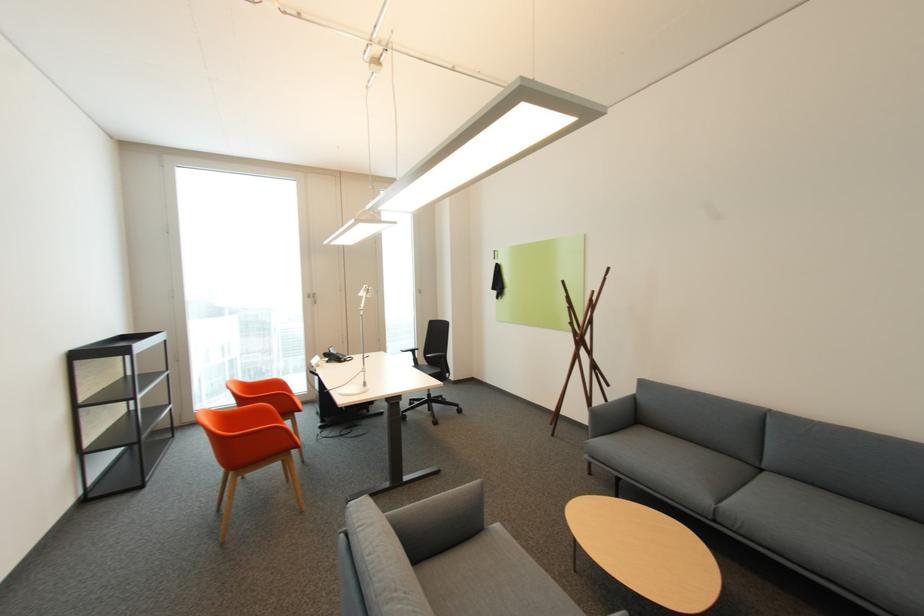
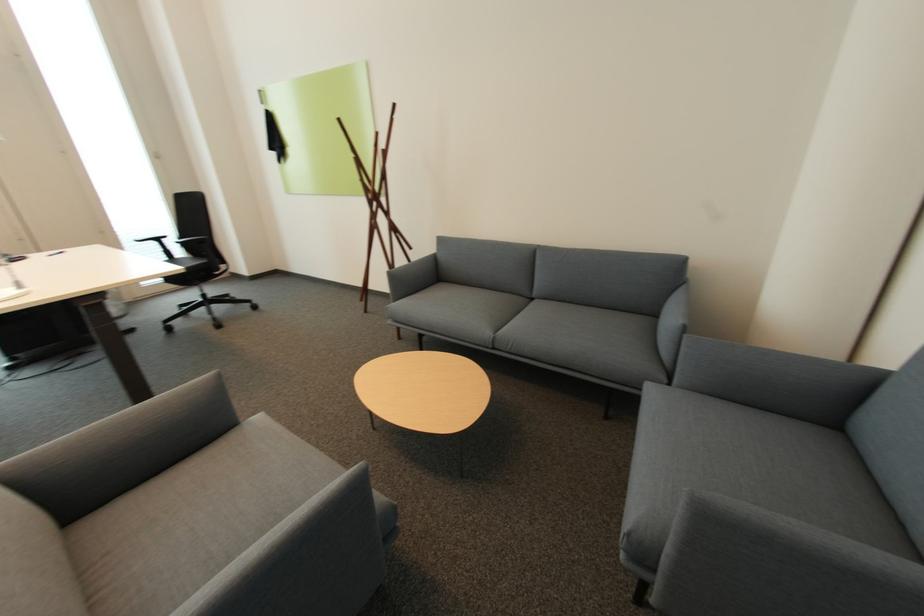
Find the pixel in the second image that matches point 428,362 in the first image.

(187, 253)